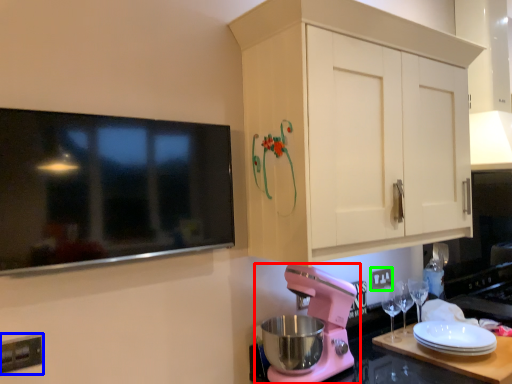
Question: Estimate the real-world distances between objects in this image. Which object is farther from mixer (highlighted by a red box), electric outlet (highlighted by a blue box) or electric outlet (highlighted by a green box)?

Choices:
 (A) electric outlet
 (B) electric outlet

Answer: (A)